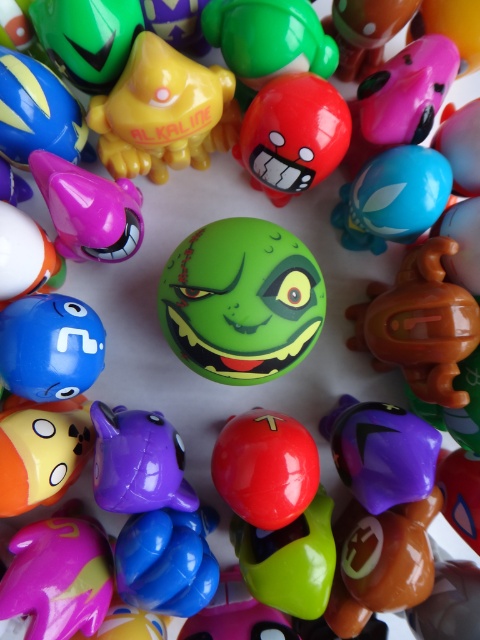
Based on the photo, you are a toy collector examining the image of the figurines. You need to place a new toy exactly at the center of the image. However, you must ensure that the new toy does not overlap with the yellow matte cat at upper left. Is the center of the image safe to place the new toy without overlapping?

The yellow matte cat at upper left is located at point (164, 113), which is not the center of the image. Therefore, placing the new toy at the center would not overlap with the yellow matte cat at upper left.

You are a child trying to reach for the toy at point (294, 99) and the toy at point (312, 22). Which toy is closer to you?

The toy at point (294, 99) is closer to you because it is in front of the toy at point (312, 22).